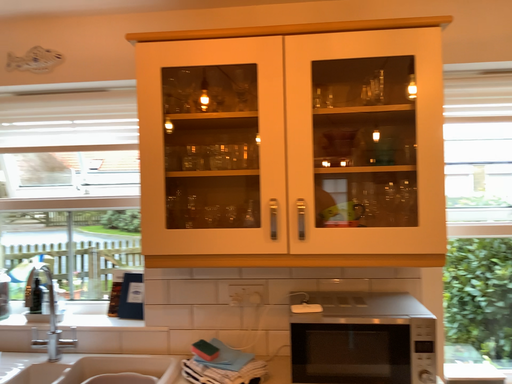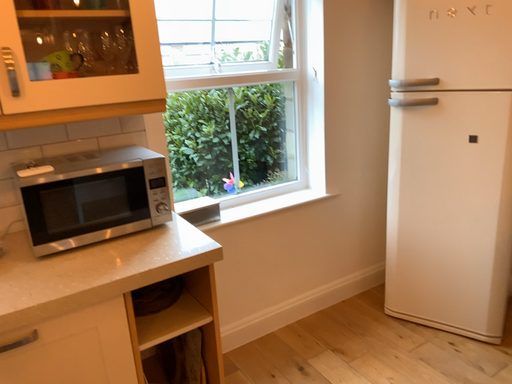
Question: How did the camera likely rotate when shooting the video?

Choices:
 (A) rotated right
 (B) rotated left

Answer: (A)